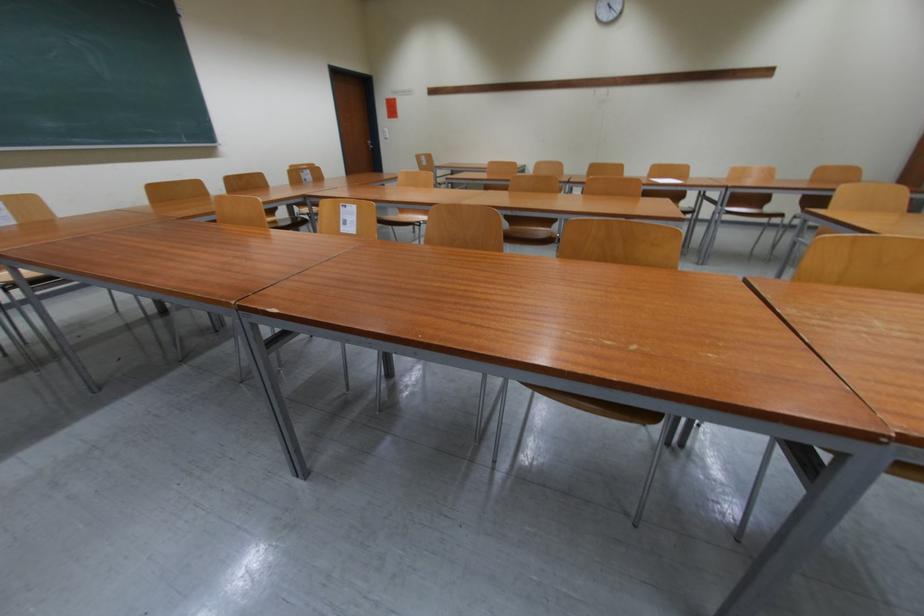
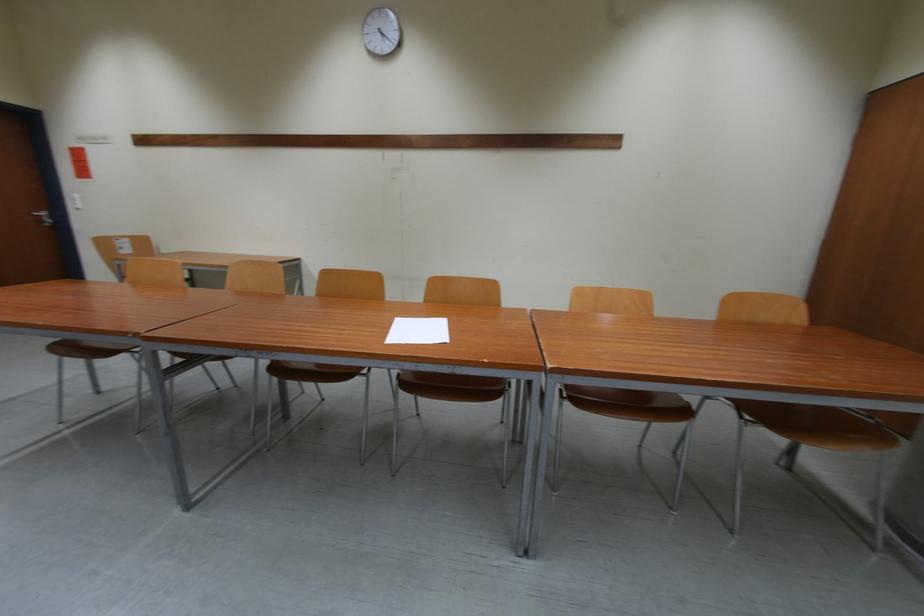
What movement of the cameraman would produce the second image?

The cameraman walked toward right, forward.